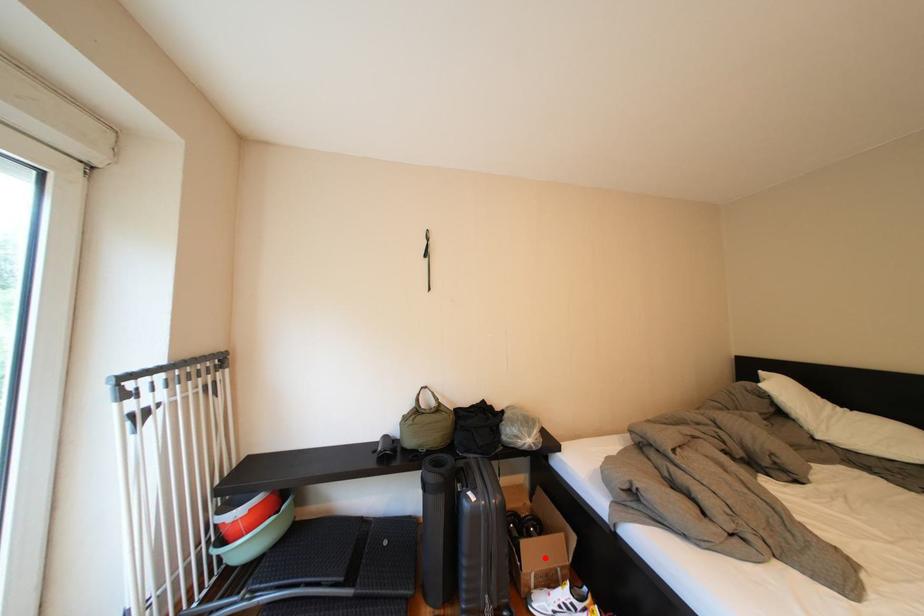
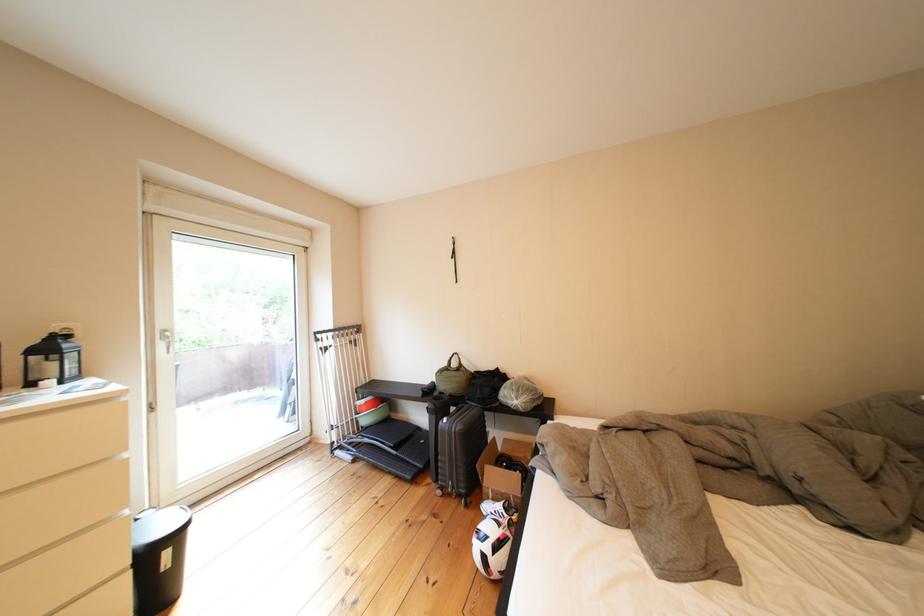
Question: I am providing you with two images of the same scene from different viewpoints. A red point is shown in image1. For the corresponding object point in image2, is it positioned nearer or farther from the camera?

Choices:
 (A) Nearer
 (B) Farther

Answer: (A)